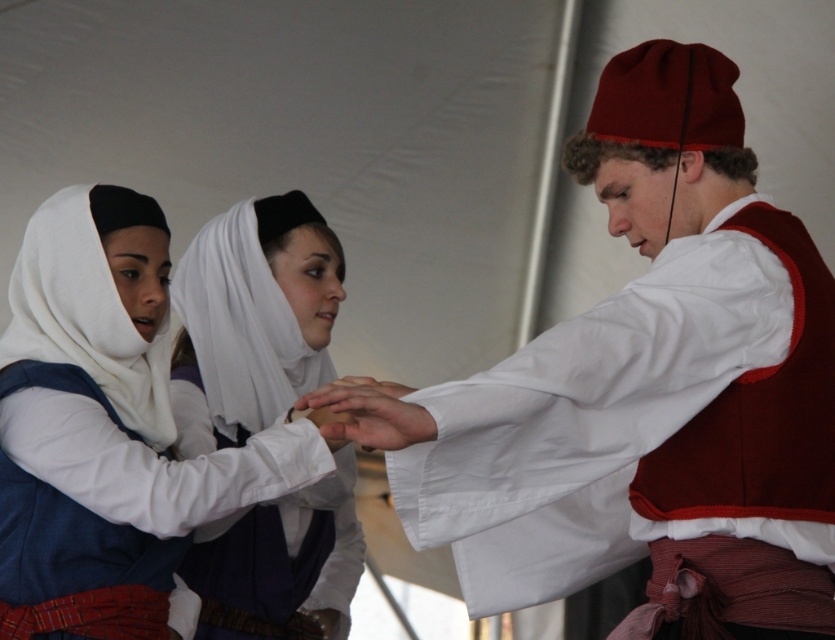
Question: Which of the following is the farthest from the observer?

Choices:
 (A) white smooth hand at center
 (B) matte red hat at center

Answer: (B)

Question: Does white satin headscarf at center come in front of white smooth hand at center?

Choices:
 (A) no
 (B) yes

Answer: (A)

Question: Which of the following is the closest to the observer?

Choices:
 (A) (694, 337)
 (B) (377, 397)
 (C) (243, 358)

Answer: (B)

Question: Can you confirm if matte red hat at center is positioned above white satin headscarf at center?

Choices:
 (A) yes
 (B) no

Answer: (A)

Question: Which object is closer to the camera taking this photo?

Choices:
 (A) matte red hat at center
 (B) white smooth hand at center

Answer: (B)

Question: Can you confirm if white satin headscarf at center is positioned to the right of white smooth hand at center?

Choices:
 (A) no
 (B) yes

Answer: (A)